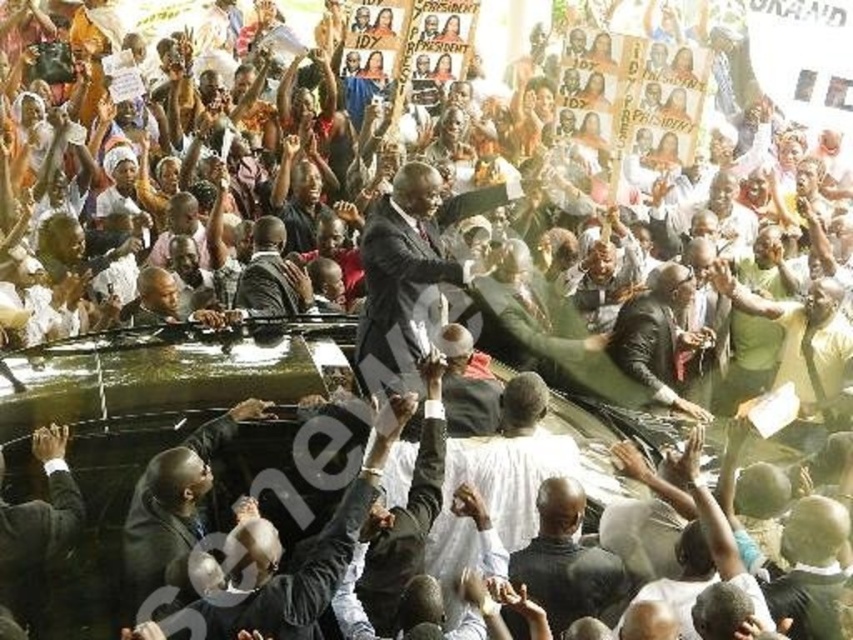
Looking at this image, measure the distance between dark brown leather jacket at center and black suit at center.

dark brown leather jacket at center and black suit at center are 43.81 meters apart from each other.

From the picture: Does dark brown leather jacket at center appear on the left side of black suit at center?

No, dark brown leather jacket at center is not to the left of black suit at center.

Locate an element on the screen. This screenshot has height=640, width=853. dark brown leather jacket at center is located at coordinates (662, 340).

Is point (1, 604) positioned in front of point (796, 381)?

Yes, it is in front of point (796, 381).

Is point (6, 588) less distant than point (746, 291)?

Yes, point (6, 588) is closer to viewer.

The height and width of the screenshot is (640, 853). I want to click on black suit at center, so click(x=36, y=529).

Is point (518, 628) positioned behind point (747, 310)?

That is False.

Measure the distance between point (622,570) and camera.

172.30 feet

Which is in front, point (553, 522) or point (813, 323)?

Point (553, 522) is more forward.

The image size is (853, 640). I want to click on dark gray suit at center, so click(567, 561).